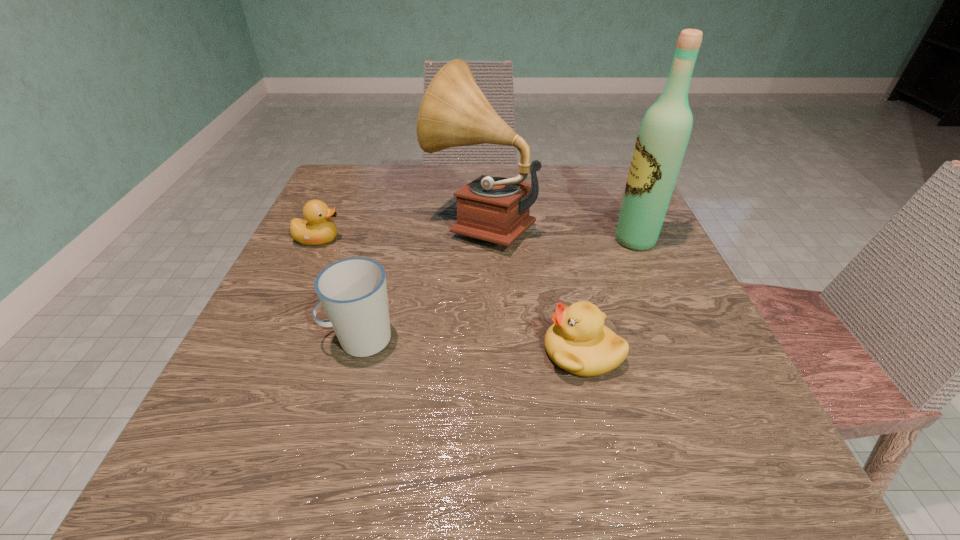
Image resolution: width=960 pixels, height=540 pixels. Identify the location of free space located 0.160m on the front-facing side of the wine bottle. (535, 240).

This screenshot has height=540, width=960. What are the coordinates of `vacant space located 0.210m on the horn of the phonograph record` in the screenshot? It's located at (327, 221).

At what (x,y) coordinates should I click in order to perform the action: click on free location located on the horn of the phonograph record. Please return your answer as a coordinate pair (x, y). Looking at the image, I should click on (384, 221).

The width and height of the screenshot is (960, 540). In order to click on vacant space located 0.200m on the horn of the phonograph record in this screenshot , I will do `click(332, 221)`.

Identify the location of vacant space positioned with a handle on the side of the fourth object from right to left. (267, 339).

Locate an element on the screen. This screenshot has height=540, width=960. free location located with a handle on the side of the fourth object from right to left is located at coordinates (286, 339).

Where is `free space located with a handle on the side of the fourth object from right to left`? This screenshot has width=960, height=540. free space located with a handle on the side of the fourth object from right to left is located at coordinates (260, 339).

Find the location of `vacant space located on the front-facing side of the right duckling`. vacant space located on the front-facing side of the right duckling is located at coordinates (399, 353).

Image resolution: width=960 pixels, height=540 pixels. I want to click on vacant space positioned 0.120m on the front-facing side of the right duckling, so click(x=466, y=353).

The height and width of the screenshot is (540, 960). In order to click on free space located 0.260m on the front-facing side of the right duckling in this screenshot , I will do `click(372, 353)`.